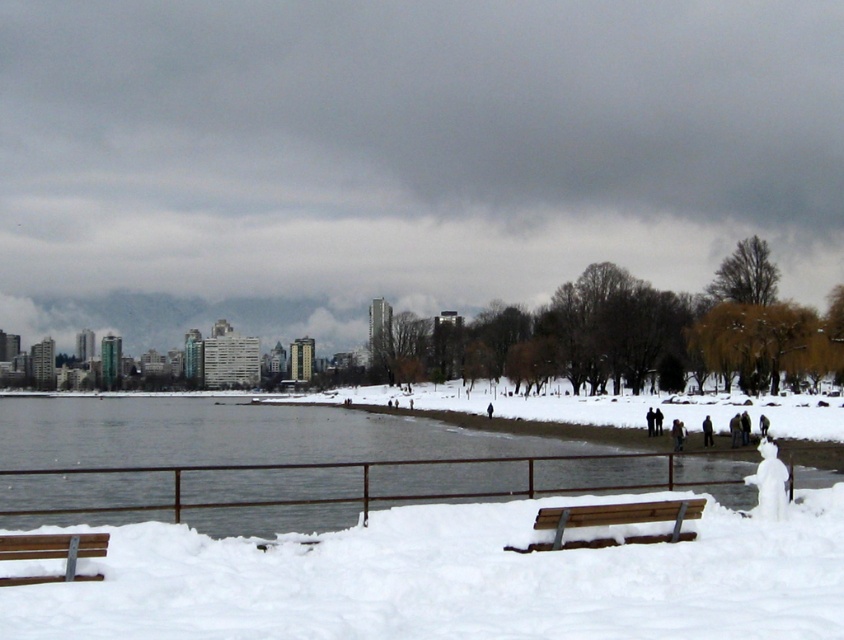
Between point (252, 440) and point (626, 518), which one is positioned in front?

Point (626, 518) is in front.

Can you confirm if gray metallic river at center is shorter than wooden bench at lower center?

No, gray metallic river at center is not shorter than wooden bench at lower center.

Does point (448, 454) come farther from viewer compared to point (613, 516)?

Yes, it is behind point (613, 516).

This screenshot has width=844, height=640. In order to click on gray metallic river at center in this screenshot , I will do `click(300, 444)`.

Who is more distant from viewer, (x=644, y=618) or (x=634, y=513)?

The point (x=634, y=513) is behind.

Between white fluffy snow at lower center and wooden bench at lower center, which one appears on the right side from the viewer's perspective?

wooden bench at lower center

The width and height of the screenshot is (844, 640). What do you see at coordinates (457, 579) in the screenshot? I see `white fluffy snow at lower center` at bounding box center [457, 579].

The height and width of the screenshot is (640, 844). Find the location of `white fluffy snow at lower center`. white fluffy snow at lower center is located at coordinates (457, 579).

Can you confirm if gray metallic river at center is taller than wooden park bench at lower left?

Indeed, gray metallic river at center has a greater height compared to wooden park bench at lower left.

Consider the image. Which is above, gray metallic river at center or wooden park bench at lower left?

wooden park bench at lower left is higher up.

The height and width of the screenshot is (640, 844). Describe the element at coordinates (300, 444) in the screenshot. I see `gray metallic river at center` at that location.

You are a GUI agent. You are given a task and a screenshot of the screen. Output one action in this format:
    pyautogui.click(x=<x>, y=<y>)
    Task: Click on the gray metallic river at center
    
    Given the screenshot: What is the action you would take?
    coord(300,444)